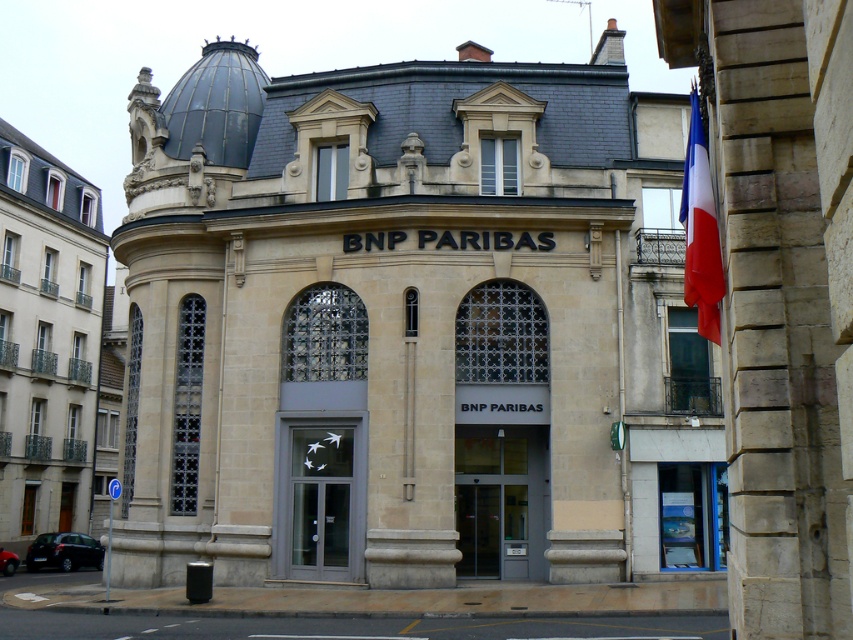
In the scene shown: Which is above, transparent glass door at center or matte gray door at center?

transparent glass door at center

Which is in front, point (343, 438) or point (521, 467)?

Positioned in front is point (343, 438).

You are a GUI agent. You are given a task and a screenshot of the screen. Output one action in this format:
    pyautogui.click(x=<x>, y=<y>)
    Task: Click on the transparent glass door at center
    The height and width of the screenshot is (640, 853).
    Given the screenshot: What is the action you would take?
    pyautogui.click(x=318, y=497)

Based on the photo, can you confirm if red fabric flag at upper right is taller than metallic red car at lower left?

Correct, red fabric flag at upper right is much taller as metallic red car at lower left.

Between point (700, 326) and point (15, 563), which one is positioned behind?

The point (15, 563) is behind.

This screenshot has height=640, width=853. Identify the location of red fabric flag at upper right. (700, 230).

Is transparent glass door at center further to the viewer compared to dark gray metallic car at lower left?

No, transparent glass door at center is closer to the viewer.

Describe the element at coordinates (318, 497) in the screenshot. I see `transparent glass door at center` at that location.

The height and width of the screenshot is (640, 853). I want to click on transparent glass door at center, so click(318, 497).